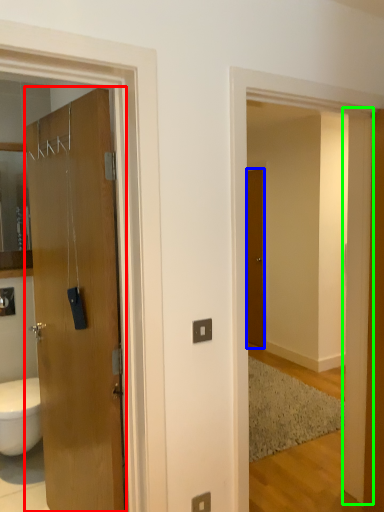
Question: Based on their relative distances, which object is farther from door (highlighted by a red box)? Choose from door (highlighted by a blue box) and pillar (highlighted by a green box).

Choices:
 (A) door
 (B) pillar

Answer: (A)